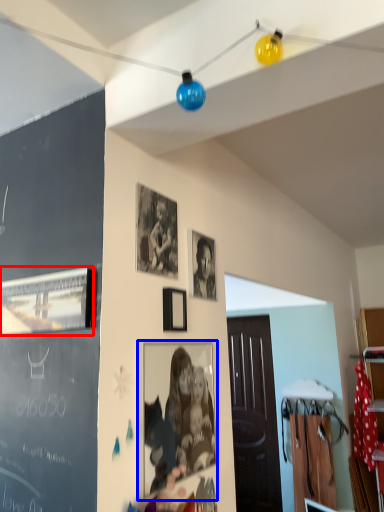
Question: Which object is closer to the camera taking this photo, picture frame (highlighted by a red box) or picture frame (highlighted by a blue box)?

Choices:
 (A) picture frame
 (B) picture frame

Answer: (A)